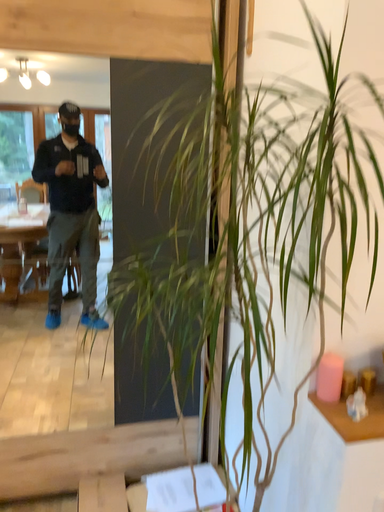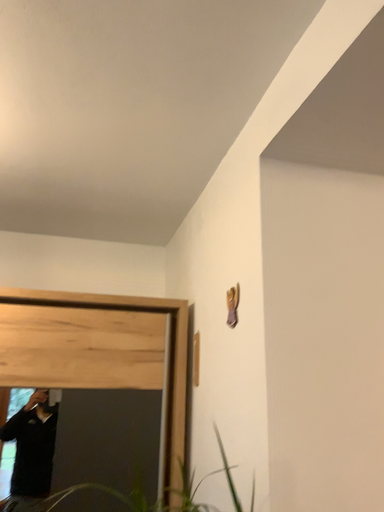
Question: How did the camera likely rotate when shooting the video?

Choices:
 (A) rotated upward
 (B) rotated downward

Answer: (A)